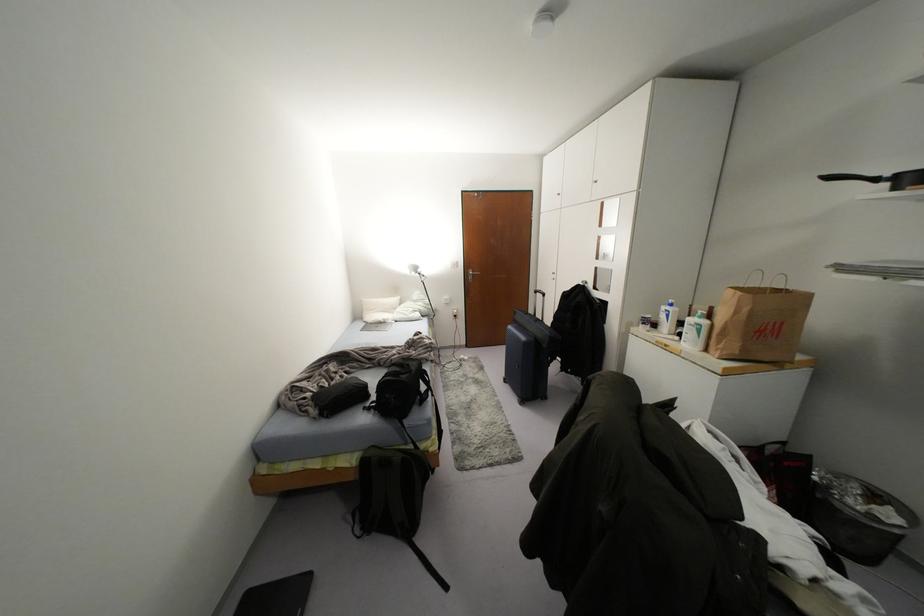
Image resolution: width=924 pixels, height=616 pixels. In order to click on closed laptop in this screenshot , I will do `click(377, 326)`.